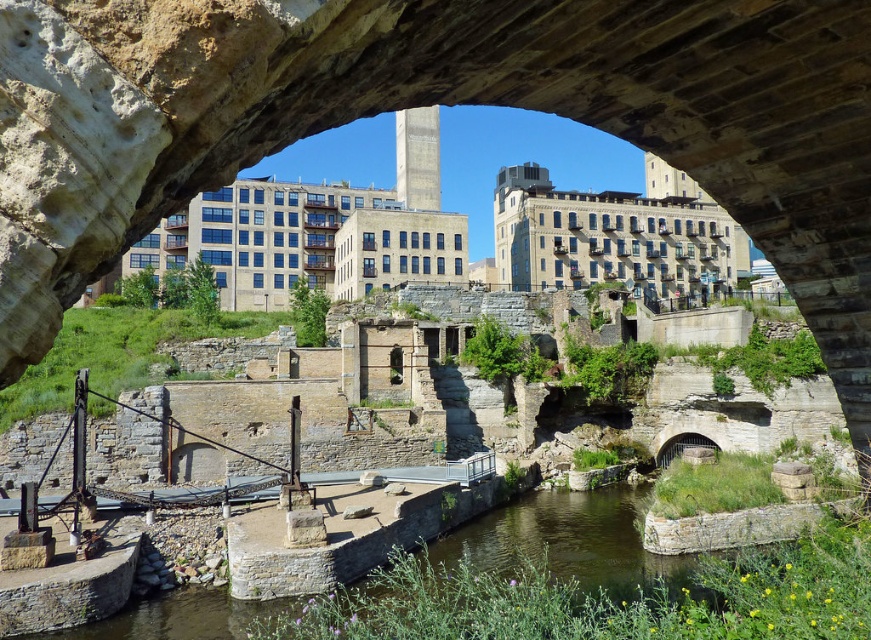
Question: Does stone arch bridge at center have a larger size compared to clear water at center?

Choices:
 (A) yes
 (B) no

Answer: (A)

Question: Which point is farther to the camera?

Choices:
 (A) stone arch bridge at center
 (B) clear water at center

Answer: (B)

Question: Is stone arch bridge at center further to camera compared to clear water at center?

Choices:
 (A) yes
 (B) no

Answer: (B)

Question: Where is stone arch bridge at center located in relation to clear water at center in the image?

Choices:
 (A) right
 (B) left

Answer: (A)

Question: Which point is closer to the camera taking this photo?

Choices:
 (A) (788, 152)
 (B) (186, 605)

Answer: (A)